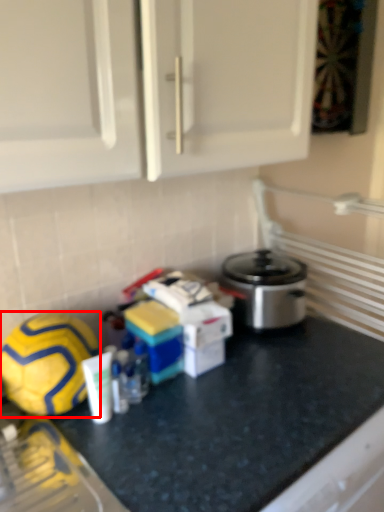
Question: From the image, what is the correct spatial relationship of football (annotated by the red box) in relation to counter?

Choices:
 (A) right
 (B) left

Answer: (B)